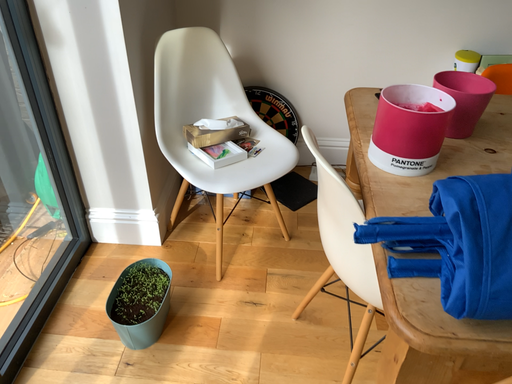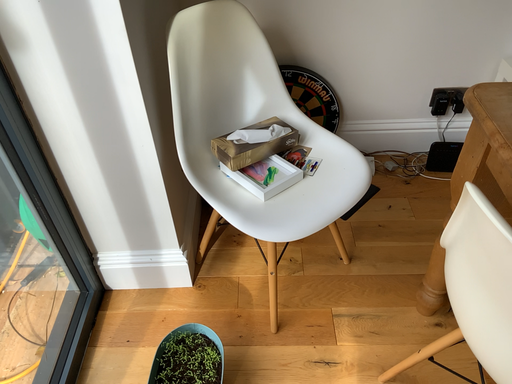
Question: How did the camera likely rotate when shooting the video?

Choices:
 (A) rotated downward
 (B) rotated upward

Answer: (A)